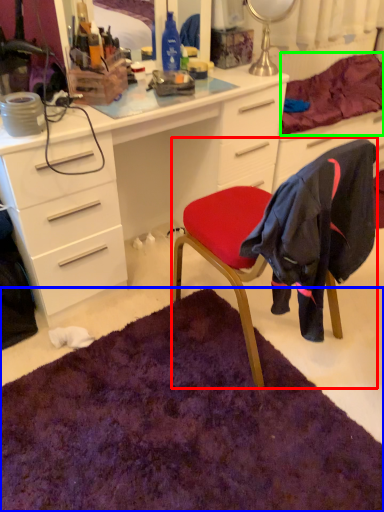
Question: Estimate the real-world distances between objects in this image. Which object is closer to chair (highlighted by a red box), mat (highlighted by a blue box) or bedding (highlighted by a green box)?

Choices:
 (A) mat
 (B) bedding

Answer: (A)